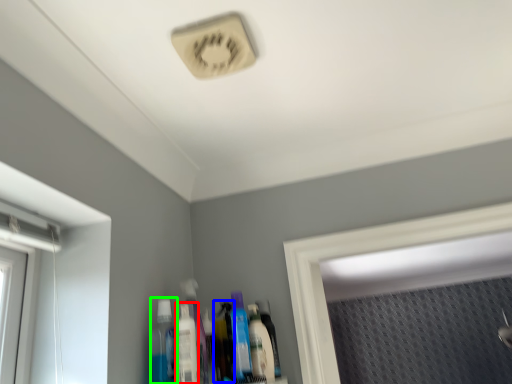
Question: Which object is positioned farthest from mouthwash (highlighted by a red box)? Select from toiletry (highlighted by a blue box) and mouthwash (highlighted by a green box).

Choices:
 (A) toiletry
 (B) mouthwash

Answer: (A)